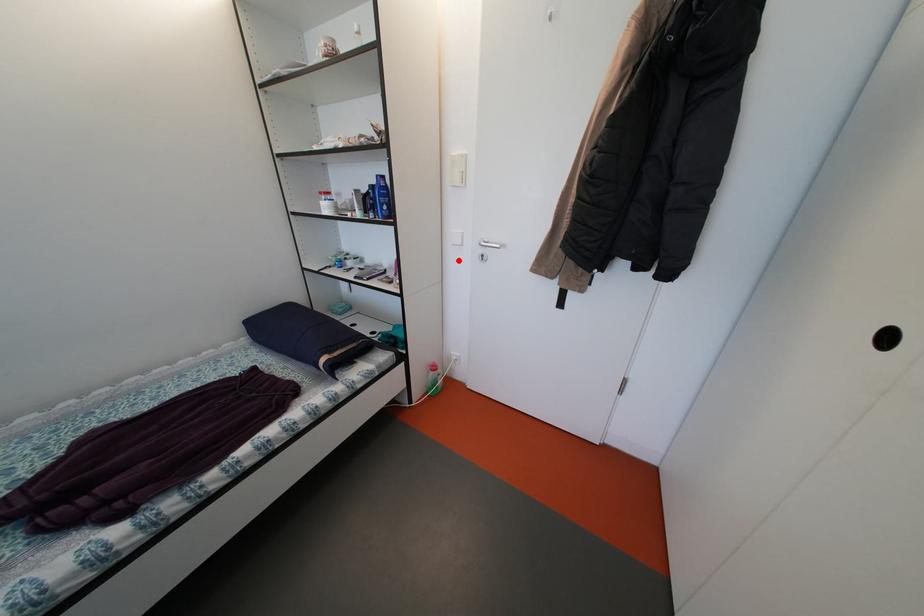
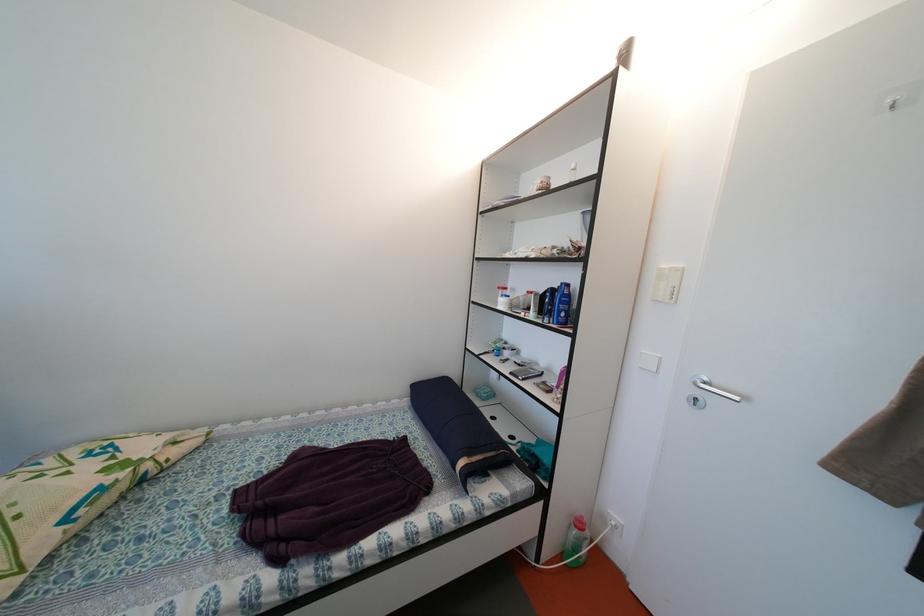
Where in the second image is the point corresponding to the highlighted location from the first image?

(642, 385)